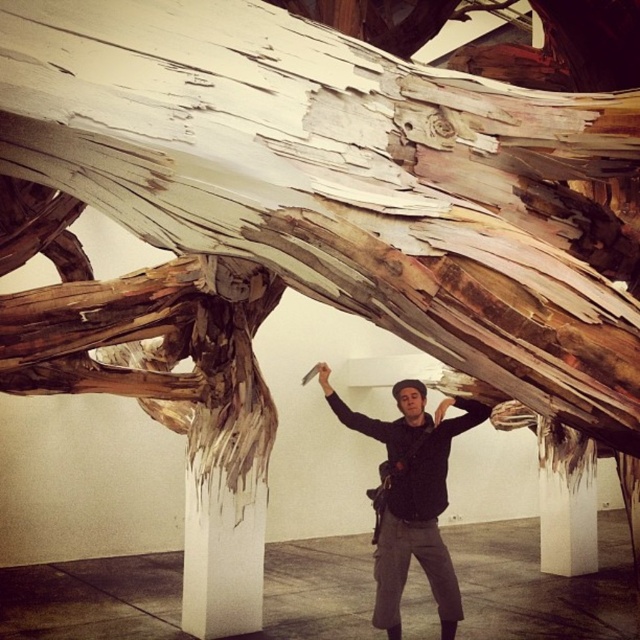
Question: Can you confirm if matte black jacket at center is positioned to the right of white smooth pillar at lower center?

Choices:
 (A) yes
 (B) no

Answer: (B)

Question: Can you confirm if matte black jacket at center is positioned to the right of white smooth pillar at lower center?

Choices:
 (A) yes
 (B) no

Answer: (B)

Question: Which point is farther from the camera taking this photo?

Choices:
 (A) (417, 557)
 (B) (566, 540)

Answer: (B)

Question: Which point is closer to the camera?

Choices:
 (A) white smooth pillar at lower center
 (B) matte black jacket at center

Answer: (B)

Question: Is matte black jacket at center below white smooth pillar at lower center?

Choices:
 (A) no
 (B) yes

Answer: (A)

Question: Among these points, which one is nearest to the camera?

Choices:
 (A) (420, 547)
 (B) (592, 548)

Answer: (A)